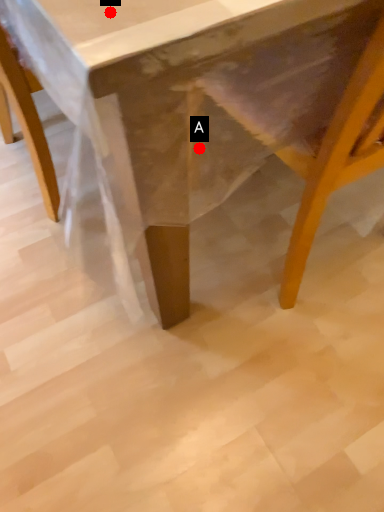
Question: Two points are circled on the image, labeled by A and B beside each circle. Among these points, which one is farthest from the camera?

Choices:
 (A) A is further
 (B) B is further

Answer: (A)